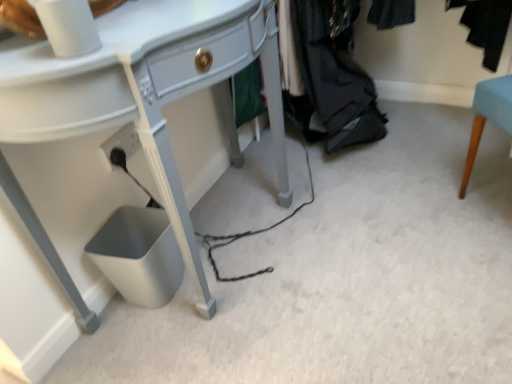
At what (x,y) coordinates should I click in order to perform the action: click on empty space that is in between dark gray fabric at lower right and matte white desk at center. Please return your answer as a coordinate pair (x, y). This screenshot has width=512, height=384. Looking at the image, I should click on (311, 211).